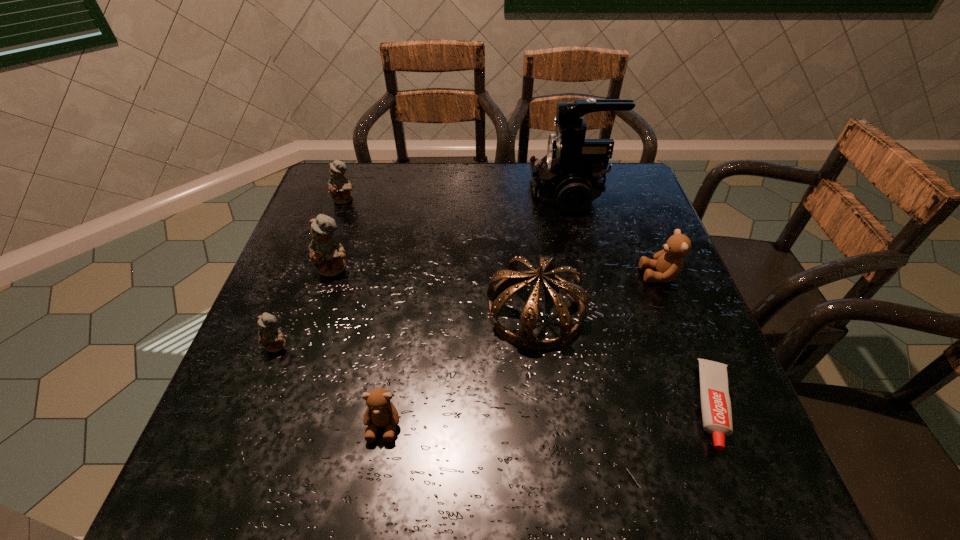
You are a GUI agent. You are given a task and a screenshot of the screen. Output one action in this format:
    pyautogui.click(x=<x>, y=<y>)
    Task: Click on the vacant area between the camcorder and the farthest blue teddy bear
    The image size is (960, 540).
    Given the screenshot: What is the action you would take?
    pyautogui.click(x=458, y=196)

The image size is (960, 540). Find the location of `empty space that is in between the tiara and the nearest teddy bear`. empty space that is in between the tiara and the nearest teddy bear is located at coordinates (459, 368).

Find the location of a particular element. unoccupied position between the second nearest teddy bear and the fourth teddy bear from left to right is located at coordinates (330, 386).

Locate an element on the screen. vacant space that is in between the camcorder and the fourth farthest teddy bear is located at coordinates (424, 269).

Image resolution: width=960 pixels, height=540 pixels. I want to click on vacant space in between the camcorder and the brown tiara, so click(x=553, y=252).

Find the location of a particular element. The width and height of the screenshot is (960, 540). free area in between the shortest object and the fourth farthest teddy bear is located at coordinates (496, 375).

Identify the location of vacant area between the tiara and the second teddy bear from right to left. (459, 368).

At what (x,y) coordinates should I click in order to perform the action: click on vacant space in between the left brown teddy bear and the tallest object. Please return your answer as a coordinate pair (x, y). The width and height of the screenshot is (960, 540). Looking at the image, I should click on (477, 309).

You are a GUI agent. You are given a task and a screenshot of the screen. Output one action in this format:
    pyautogui.click(x=<x>, y=<y>)
    Task: Click on the free spot between the farther brown teddy bear and the nearest blue teddy bear
    
    Given the screenshot: What is the action you would take?
    pyautogui.click(x=468, y=310)

Find the location of `the sixth closest object relative to the camcorder`. the sixth closest object relative to the camcorder is located at coordinates (381, 412).